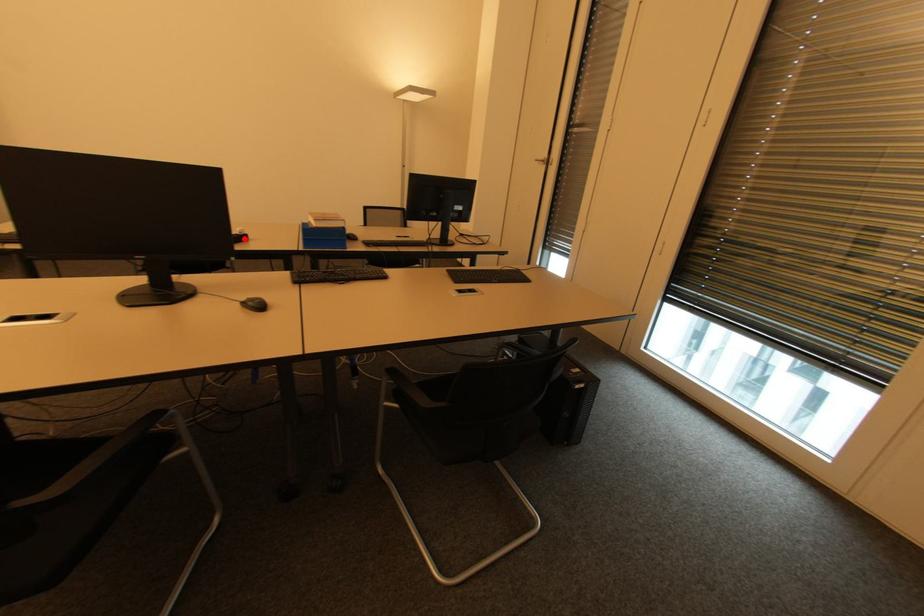
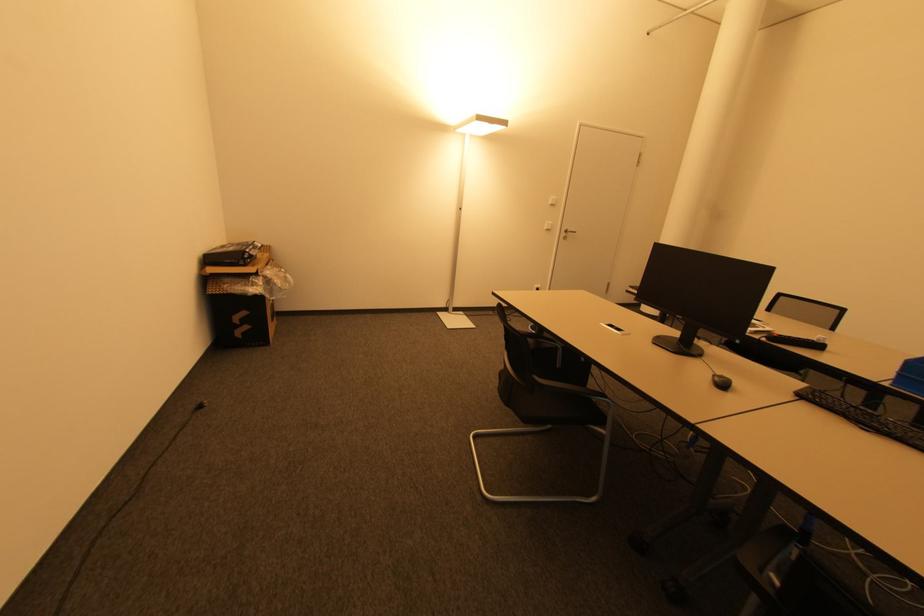
Question: I am providing you with two images of the same scene from different viewpoints. A red point is marked on the first image. At the location where the point appears in image 1, is it still visible in image 2?

Choices:
 (A) Yes
 (B) No

Answer: (A)